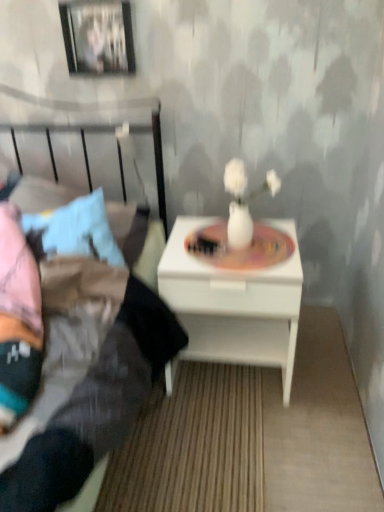
At what (x,y) coordinates should I click in order to perform the action: click on vacant space in front of white glossy nightstand at center. Please return your answer as a coordinate pair (x, y). Looking at the image, I should click on (241, 447).